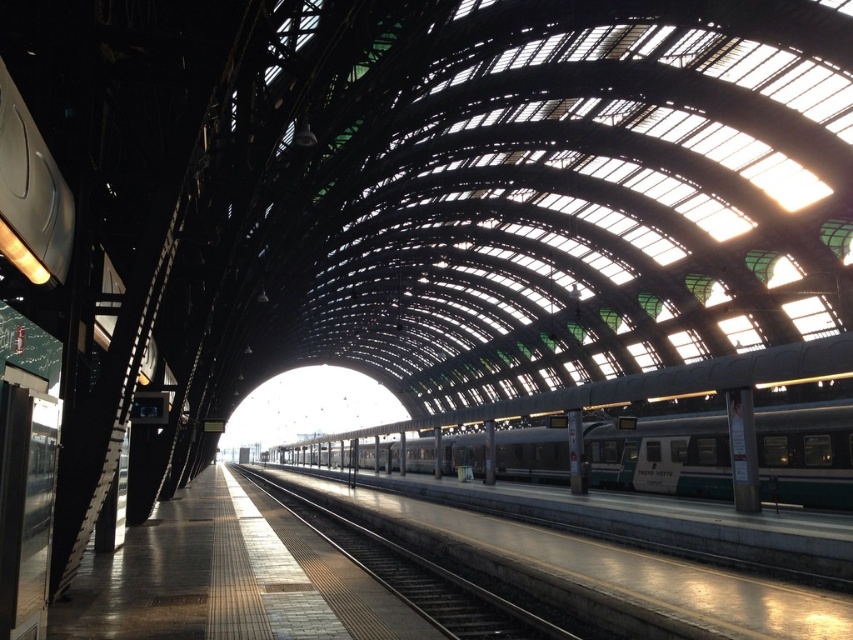
Question: Among these objects, which one is farthest from the camera?

Choices:
 (A) metal train track at center
 (B) teal metallic train at center

Answer: (B)

Question: Is teal metallic train at center bigger than metal train track at center?

Choices:
 (A) no
 (B) yes

Answer: (B)

Question: Is teal metallic train at center wider than metal train track at center?

Choices:
 (A) no
 (B) yes

Answer: (B)

Question: Does teal metallic train at center appear under metal train track at center?

Choices:
 (A) yes
 (B) no

Answer: (A)

Question: Which object appears closest to the camera in this image?

Choices:
 (A) metal train track at center
 (B) teal metallic train at center

Answer: (A)

Question: Which point is farther from the camera taking this photo?

Choices:
 (A) (457, 616)
 (B) (787, 451)

Answer: (B)